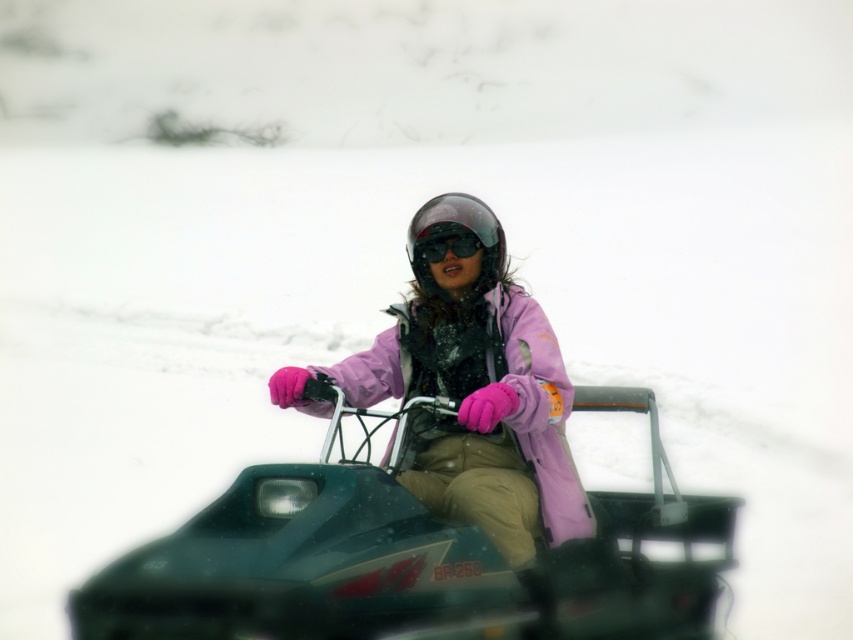
Who is positioned more to the left, metallic teal snowmobile at center or black matte goggles at center?

black matte goggles at center

Is point (705, 589) positioned in front of point (457, 230)?

Yes, point (705, 589) is in front of point (457, 230).

Is point (310, 609) positioned behind point (454, 253)?

No, (310, 609) is closer to viewer.

The height and width of the screenshot is (640, 853). Identify the location of metallic teal snowmobile at center. (410, 557).

Looking at this image, is pink matte jacket at center below black matte goggles at center?

Yes, pink matte jacket at center is below black matte goggles at center.

Find the location of a particular element. pink matte jacket at center is located at coordinates tap(471, 392).

The image size is (853, 640). In order to click on pink matte jacket at center in this screenshot , I will do `click(471, 392)`.

Does pink matte jacket at center appear on the left side of transparent plastic helmet at center?

Correct, you'll find pink matte jacket at center to the left of transparent plastic helmet at center.

Does pink matte jacket at center appear on the right side of transparent plastic helmet at center?

In fact, pink matte jacket at center is to the left of transparent plastic helmet at center.

You are a GUI agent. You are given a task and a screenshot of the screen. Output one action in this format:
    pyautogui.click(x=<x>, y=<y>)
    Task: Click on the pink matte jacket at center
    The width and height of the screenshot is (853, 640).
    Given the screenshot: What is the action you would take?
    pyautogui.click(x=471, y=392)